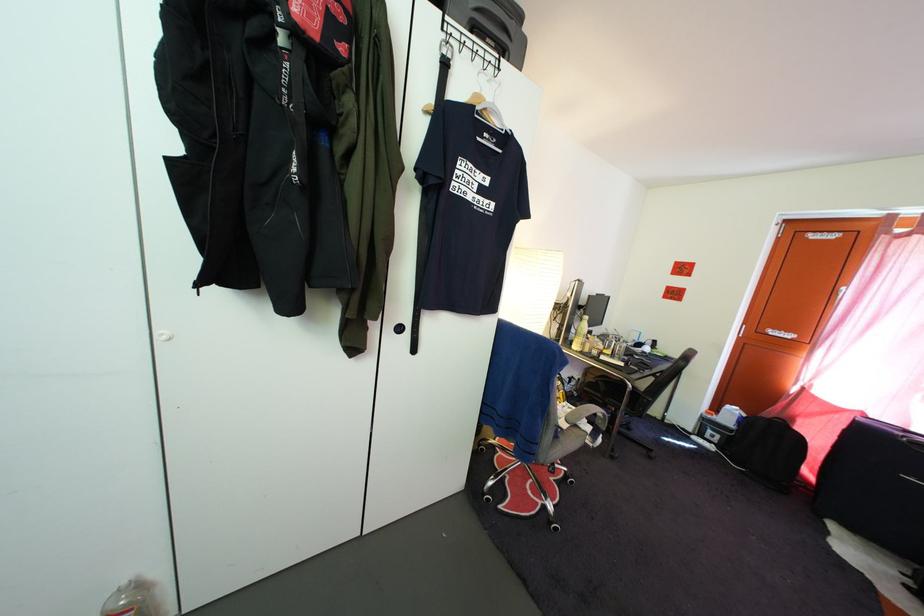
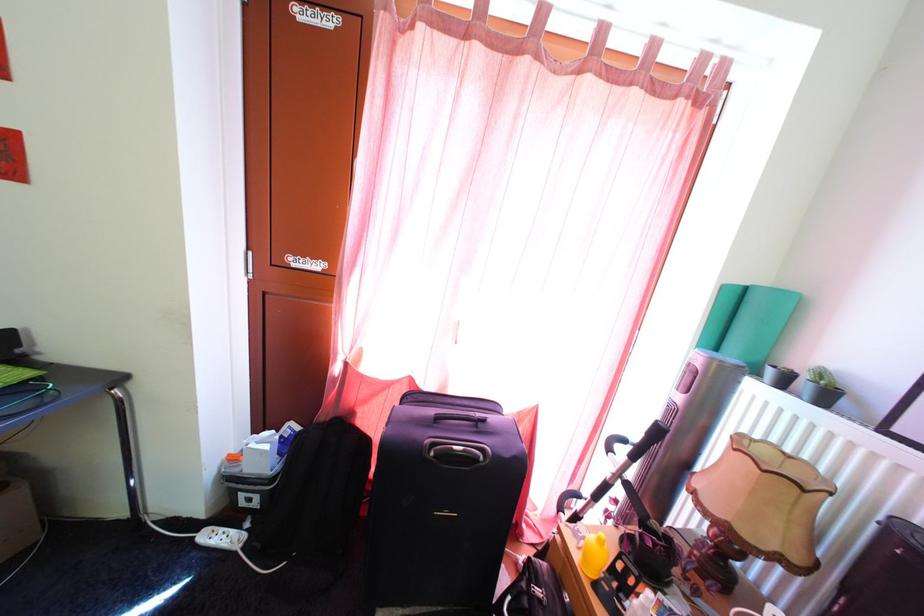
Question: I am providing you with two images of the same scene from different viewpoints. Please identify which objects are invisible in image2.

Choices:
 (A) blue exercise ball
 (B) black speaker
 (C) rolled teal mat
 (D) yellow plastic cup

Answer: (B)